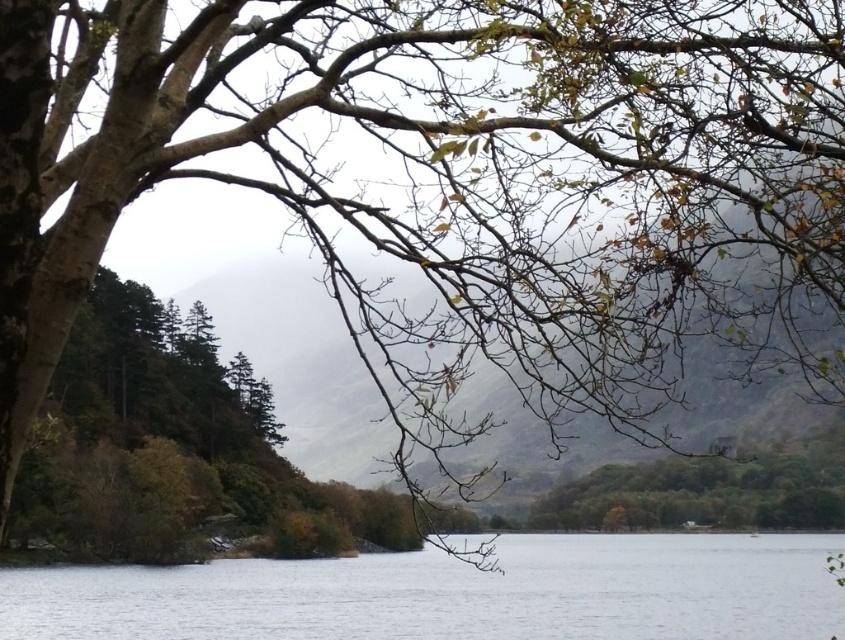
Question: Where is transparent water at center located in relation to green matte tree at lower right in the image?

Choices:
 (A) left
 (B) right

Answer: (A)

Question: Which object is closer to the camera taking this photo?

Choices:
 (A) transparent water at center
 (B) green matte tree at lower right

Answer: (A)

Question: Which point is farther to the camera?

Choices:
 (A) (813, 460)
 (B) (796, 564)

Answer: (B)

Question: Is transparent water at center to the left of green matte tree at lower right from the viewer's perspective?

Choices:
 (A) no
 (B) yes

Answer: (B)

Question: Does transparent water at center have a larger size compared to green matte tree at lower right?

Choices:
 (A) yes
 (B) no

Answer: (A)

Question: Among these points, which one is farthest from the camera?

Choices:
 (A) tap(800, 522)
 (B) tap(169, 634)

Answer: (B)